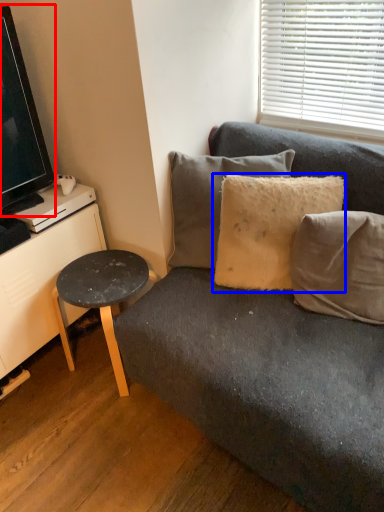
Question: Which point is closer to the camera, television (highlighted by a red box) or pillow (highlighted by a blue box)?

Choices:
 (A) television
 (B) pillow

Answer: (A)